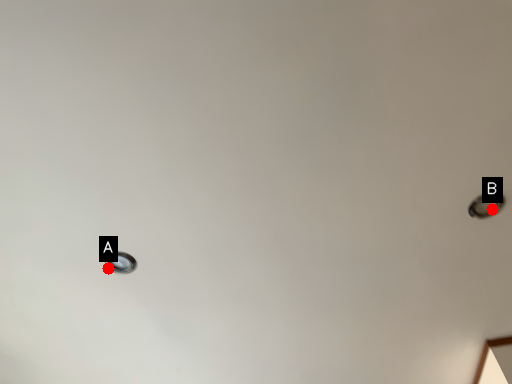
Question: Two points are circled on the image, labeled by A and B beside each circle. Among these points, which one is nearest to the camera?

Choices:
 (A) A is closer
 (B) B is closer

Answer: (B)